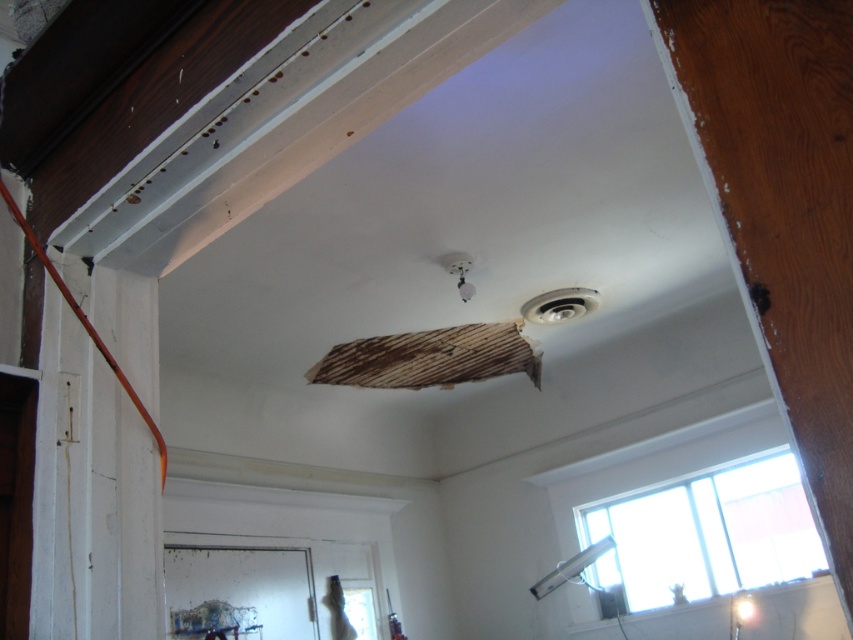
You are an interior designer assessing the damaged area. You need to install a new light fixture that must be placed exactly at point 0.956, 0.868. Can you confirm if the existing matte white light fixture at lower right is already installed at that precise location?

The matte white light fixture at lower right is already positioned at point (740, 611), so yes, it is already installed at the required location.

You are an electrician assessing the lighting fixtures in a room undergoing renovation. You see the matte white light fixture at lower right and the white glossy light fixture at upper center. Which one has a smaller width?

The matte white light fixture at lower right has a smaller width than the white glossy light fixture at upper center.

You are standing in the damaged room and need to reach a tool located at point (471, 259). There is an obstacle at point (746, 593). Will you encounter the obstacle before reaching the tool?

Point (746, 593) is further to the viewer than point (471, 259), so you will not encounter the obstacle before reaching the tool.